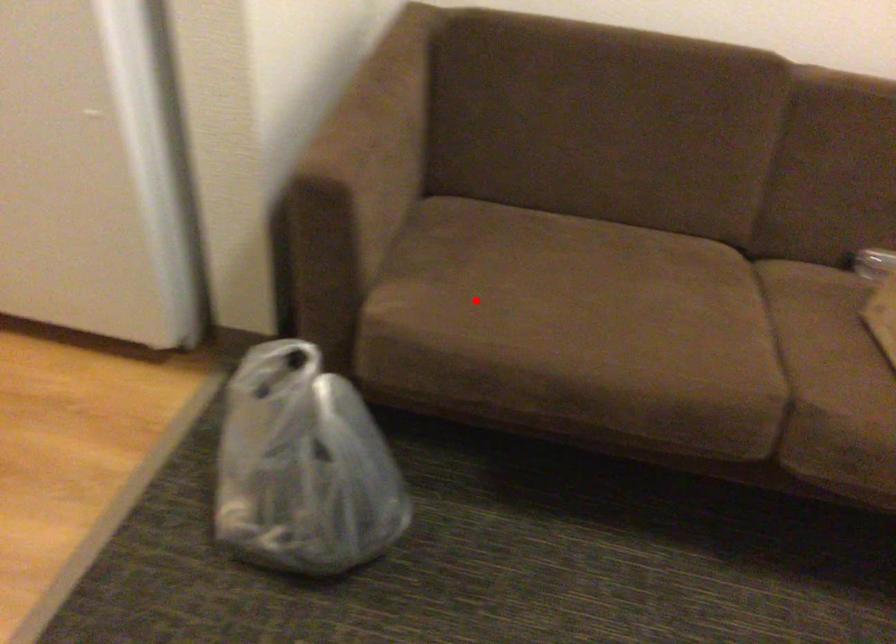
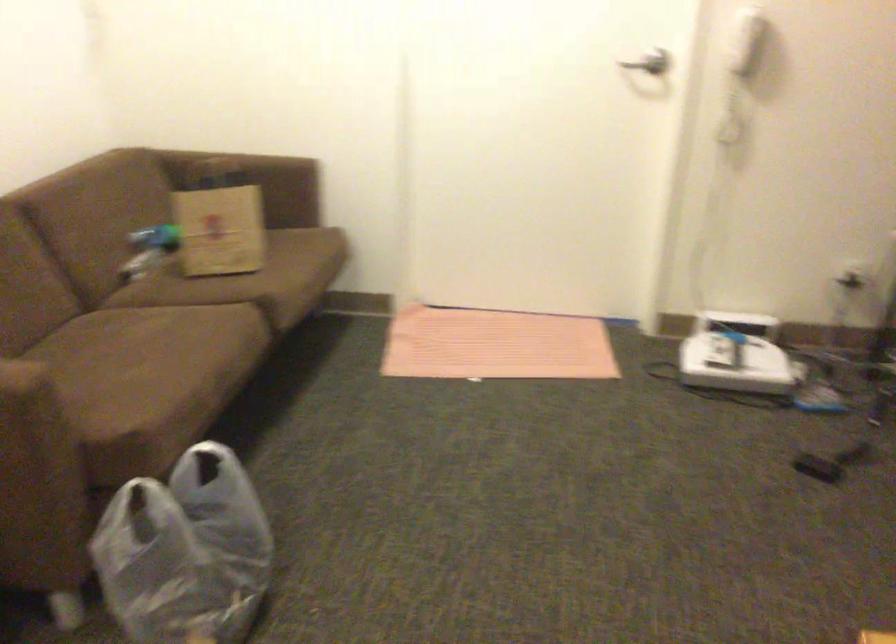
Question: I am providing you with two images of the same scene from different viewpoints. Given a red point in image1, look at the same physical point in image2. Is it:

Choices:
 (A) Closer to the viewpoint
 (B) Farther from the viewpoint

Answer: (B)